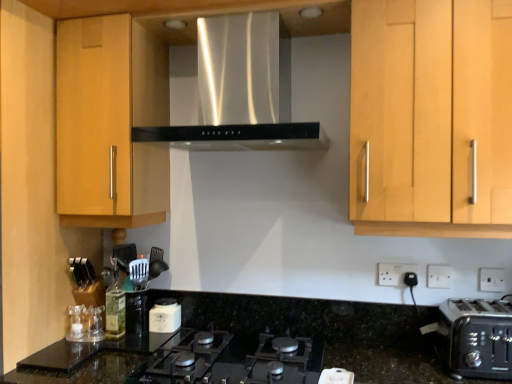
Locate an element on the screen. white plastic electric outlet at upper right, the 3th electric outlet in the back-to-front sequence is located at coordinates (490, 280).

The height and width of the screenshot is (384, 512). Describe the element at coordinates (223, 86) in the screenshot. I see `stainless steel range hood at center` at that location.

This screenshot has height=384, width=512. What do you see at coordinates (165, 316) in the screenshot?
I see `white matte jar at center` at bounding box center [165, 316].

This screenshot has height=384, width=512. Describe the element at coordinates (476, 337) in the screenshot. I see `black plastic toaster at lower right` at that location.

What is the approximate height of black glass gas stove at lower center?

It is 2.65 inches.

Where is `white plastic electric outlet at upper right, which is the first electric outlet in right-to-left order`? This screenshot has width=512, height=384. white plastic electric outlet at upper right, which is the first electric outlet in right-to-left order is located at coordinates (490, 280).

Is point (463, 328) positioned in front of point (180, 318)?

Yes.

From their relative heights in the image, would you say black plastic toaster at lower right is taller or shorter than white matte jar at center?

In the image, black plastic toaster at lower right appears to be taller than white matte jar at center.

Based on the photo, does black plastic toaster at lower right turn towards white matte jar at center?

No, black plastic toaster at lower right does not turn towards white matte jar at center.

Based on the photo, which is more to the left, black plastic toaster at lower right or white matte jar at center?

white matte jar at center is more to the left.

From the image's perspective, is black glass gas stove at lower center located above or below black granite countertop at center?

From the image's perspective, black glass gas stove at lower center appears above black granite countertop at center.

Which object is more forward, black glass gas stove at lower center or black granite countertop at center?

black granite countertop at center.

Is point (133, 377) less distant than point (91, 374)?

Yes, point (133, 377) is in front of point (91, 374).

From a real-world perspective, is black glass gas stove at lower center physically above black granite countertop at center?

Indeed, from a real-world perspective, black glass gas stove at lower center stands above black granite countertop at center.

Is white plastic toaster at lower right located outside white matte jar at center?

Yes, white plastic toaster at lower right is not within white matte jar at center.

Is white plastic toaster at lower right turned away from white matte jar at center?

white plastic toaster at lower right does not have its back to white matte jar at center.

Which object is wider, white plastic toaster at lower right or white matte jar at center?

Wider between the two is white plastic toaster at lower right.

Which is more to the right, white plastic toaster at lower right or white matte jar at center?

white plastic toaster at lower right is more to the right.

Does black granite countertop at center have a larger size compared to white plastic electric outlet at lower right, which appears as the second electric outlet when viewed from the right?

Indeed, black granite countertop at center has a larger size compared to white plastic electric outlet at lower right, which appears as the second electric outlet when viewed from the right.

Which is correct: black granite countertop at center is inside white plastic electric outlet at lower right, arranged as the second electric outlet when viewed from the front, or outside of it?

black granite countertop at center cannot be found inside white plastic electric outlet at lower right, arranged as the second electric outlet when viewed from the front.

Is black granite countertop at center in front of white plastic electric outlet at lower right, which ranks as the 2th electric outlet in back-to-front order?

Yes, the depth of black granite countertop at center is less than that of white plastic electric outlet at lower right, which ranks as the 2th electric outlet in back-to-front order.

Considering the positions of objects black granite countertop at center and white plastic electric outlet at lower right, which appears as the second electric outlet when viewed from the right, in the image provided, who is more to the right, black granite countertop at center or white plastic electric outlet at lower right, which appears as the second electric outlet when viewed from the right,?

Positioned to the right is white plastic electric outlet at lower right, which appears as the second electric outlet when viewed from the right.

Which of these two, white plastic electric outlet at lower right, arranged as the second electric outlet when viewed from the front, or black granite countertop at center, is bigger?

With larger size is black granite countertop at center.

Between point (430, 286) and point (341, 317), which one is positioned in front?

The point (430, 286) is in front.

From the image's perspective, is white plastic electric outlet at lower right, which appears as the second electric outlet when viewed from the left, on top of black granite countertop at center?

Correct, white plastic electric outlet at lower right, which appears as the second electric outlet when viewed from the left, appears higher than black granite countertop at center in the image.

From a real-world perspective, is white plastic electric outlet at lower right, which appears as the second electric outlet when viewed from the right, positioned above or below black granite countertop at center?

In terms of real-world spatial position, white plastic electric outlet at lower right, which appears as the second electric outlet when viewed from the right, is above black granite countertop at center.

Which is less distant, (x=505, y=355) or (x=435, y=267)?

The point (x=505, y=355) is closer.

Is black plastic toaster at lower right not inside white plastic electric outlet at lower right, which ranks as the 2th electric outlet in back-to-front order?

That's correct, black plastic toaster at lower right is outside of white plastic electric outlet at lower right, which ranks as the 2th electric outlet in back-to-front order.

Can you confirm if black plastic toaster at lower right is bigger than white plastic electric outlet at lower right, which appears as the second electric outlet when viewed from the left?

Correct, black plastic toaster at lower right is larger in size than white plastic electric outlet at lower right, which appears as the second electric outlet when viewed from the left.

Is black plastic toaster at lower right in front of or behind white plastic electric outlet at lower right, which appears as the second electric outlet when viewed from the left, in the image?

Clearly, black plastic toaster at lower right is in front of white plastic electric outlet at lower right, which appears as the second electric outlet when viewed from the left.

Considering the positions of points (341, 373) and (116, 320), is point (341, 373) closer to camera compared to point (116, 320)?

Yes, it is in front of point (116, 320).

Identify the location of appliance below the green glass bottle at lower left (from a real-world perspective). (336, 376).

From the image's perspective, is white plastic toaster at lower right located above or below green glass bottle at lower left?

white plastic toaster at lower right is situated lower than green glass bottle at lower left in the image.

Is white plastic toaster at lower right shorter than green glass bottle at lower left?

Yes, white plastic toaster at lower right is shorter than green glass bottle at lower left.

Locate an element on the screen. toaster above the white matte jar at center (from a real-world perspective) is located at coordinates (476, 337).

Where is `countertop that is below the black glass gas stove at lower center (from the image's perspective)`? countertop that is below the black glass gas stove at lower center (from the image's perspective) is located at coordinates (255, 343).

Estimate the real-world distances between objects in this image. Which object is further from white plastic toaster at lower right, black glass gas stove at lower center or white plastic electric outlet at lower right, placed as the 3th electric outlet when sorted from right to left?

Among the two, white plastic electric outlet at lower right, placed as the 3th electric outlet when sorted from right to left, is located further to white plastic toaster at lower right.

Which object lies nearer to the anchor point black glass gas stove at lower center, black granite countertop at center or green glass bottle at lower left?

The object closer to black glass gas stove at lower center is black granite countertop at center.

Based on their spatial positions, is white plastic electric outlet at upper right, the 3th electric outlet in the back-to-front sequence, or black plastic toaster at lower right closer to black granite countertop at center?

black plastic toaster at lower right is closer to black granite countertop at center.

Estimate the real-world distances between objects in this image. Which object is closer to black glass gas stove at lower center, black granite countertop at center or white plastic toaster at lower right?

black granite countertop at center.

Which object lies nearer to the anchor point white plastic electric outlet at lower right, placed as the 3th electric outlet when sorted from right to left, white plastic electric outlet at upper right, the 3th electric outlet in the back-to-front sequence, or black glass gas stove at lower center?

white plastic electric outlet at upper right, the 3th electric outlet in the back-to-front sequence, is closer to white plastic electric outlet at lower right, placed as the 3th electric outlet when sorted from right to left.

Based on their spatial positions, is black glass gas stove at lower center or white plastic electric outlet at upper right, the 3th electric outlet in the back-to-front sequence, closer to stainless steel range hood at center?

Based on the image, black glass gas stove at lower center appears to be nearer to stainless steel range hood at center.

Based on their spatial positions, is white plastic electric outlet at lower right, which appears as the second electric outlet when viewed from the right, or white plastic electric outlet at upper right, the third electric outlet viewed from the left, further from white plastic electric outlet at lower right, the 3th electric outlet in the front-to-back sequence?

white plastic electric outlet at upper right, the third electric outlet viewed from the left, is positioned further to the anchor white plastic electric outlet at lower right, the 3th electric outlet in the front-to-back sequence.

Looking at the image, which one is located closer to white plastic electric outlet at upper right, which is the first electric outlet in right-to-left order, white plastic electric outlet at lower right, arranged as the first electric outlet when viewed from the back, or black glass gas stove at lower center?

white plastic electric outlet at lower right, arranged as the first electric outlet when viewed from the back, lies closer to white plastic electric outlet at upper right, which is the first electric outlet in right-to-left order, than the other object.

This screenshot has height=384, width=512. Identify the location of bottle between stainless steel range hood at center and black glass gas stove at lower center in the up-down direction. (115, 308).

Locate an element on the screen. Image resolution: width=512 pixels, height=384 pixels. appliance between white matte jar at center and white plastic electric outlet at upper right, which is the first electric outlet in right-to-left order, in the horizontal direction is located at coordinates (336, 376).

Locate an element on the screen. countertop between green glass bottle at lower left and white plastic toaster at lower right from left to right is located at coordinates (255, 343).

The height and width of the screenshot is (384, 512). Identify the location of countertop located between white matte jar at center and white plastic electric outlet at lower right, acting as the 1th electric outlet starting from the left, in the left-right direction. (255, 343).